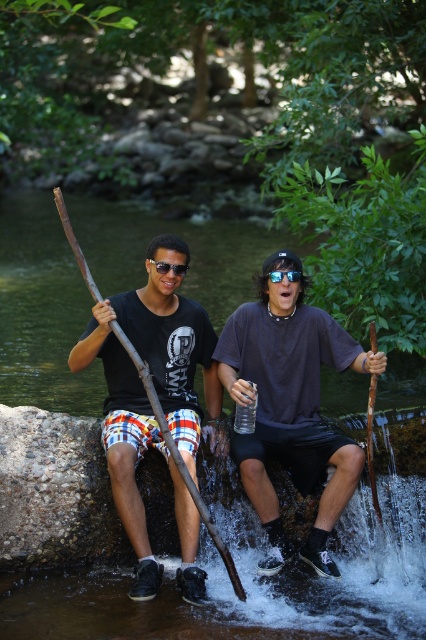
Can you confirm if matte brown stick at center is taller than wooden stick at right?

Yes, matte brown stick at center is taller than wooden stick at right.

The width and height of the screenshot is (426, 640). I want to click on matte brown stick at center, so coord(290,404).

Can you confirm if brown wood paddle at left is positioned to the right of wooden stick at right?

Incorrect, brown wood paddle at left is not on the right side of wooden stick at right.

Does brown wood paddle at left appear on the left side of wooden stick at right?

Yes, brown wood paddle at left is to the left of wooden stick at right.

Is point (69, 225) positioned in front of point (371, 417)?

Yes, it is in front of point (371, 417).

The width and height of the screenshot is (426, 640). In order to click on brown wood paddle at left in this screenshot , I will do `click(178, 458)`.

Between point (275, 352) and point (224, 548), which one is positioned behind?

Point (275, 352)

Which is above, matte brown stick at center or brown wood paddle at left?

brown wood paddle at left

Is point (307, 314) farther from camera compared to point (219, 552)?

Yes, point (307, 314) is farther from viewer.

This screenshot has width=426, height=640. Find the location of `matte brown stick at center`. matte brown stick at center is located at coordinates (290, 404).